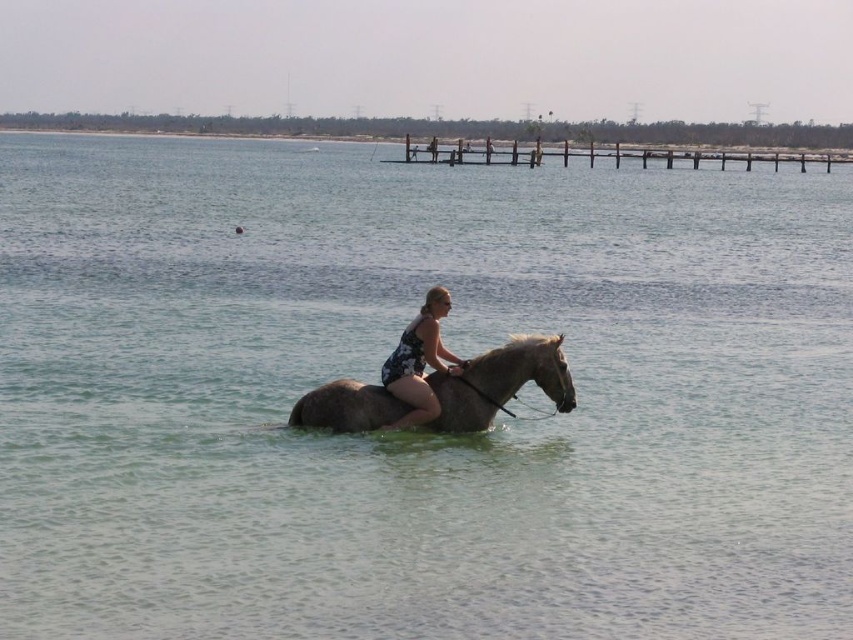
You are a photographer trying to capture the scene. You want to position yourself so that the gray matte horse at center and the wooden at upper center are both in the frame. Based on their positions, which object should you place on the left side of your photo?

The gray matte horse at center should be placed on the left side of your photo because it is positioned to the left of the wooden at upper center.

You are a photographer planning to capture the scene with the gray matte horse at center and the wooden at upper center in the same frame. Which object should you focus on first if you want to ensure both are in focus without adjusting your camera settings?

The gray matte horse at center is smaller than the wooden at upper center, so you should focus on the wooden at upper center first to ensure both are in focus.